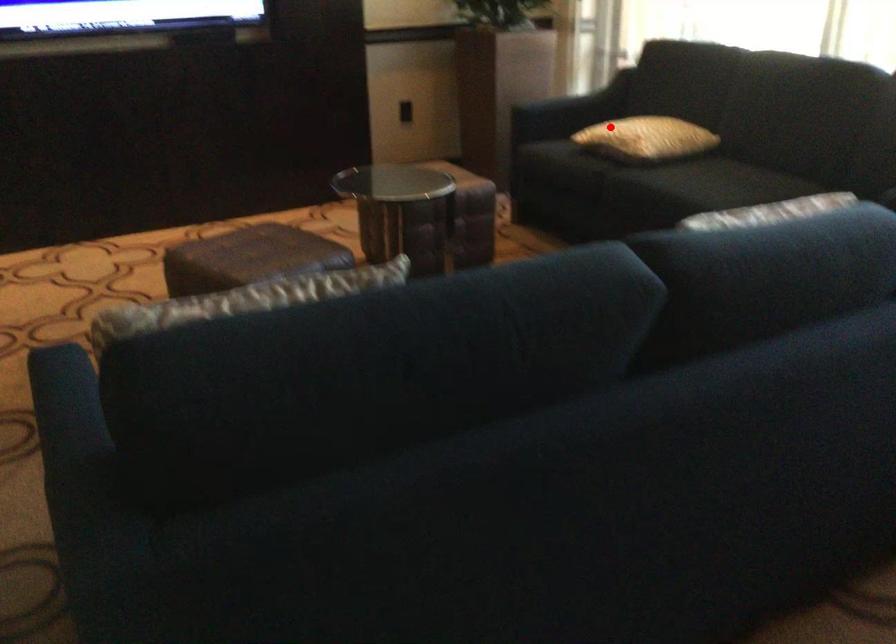
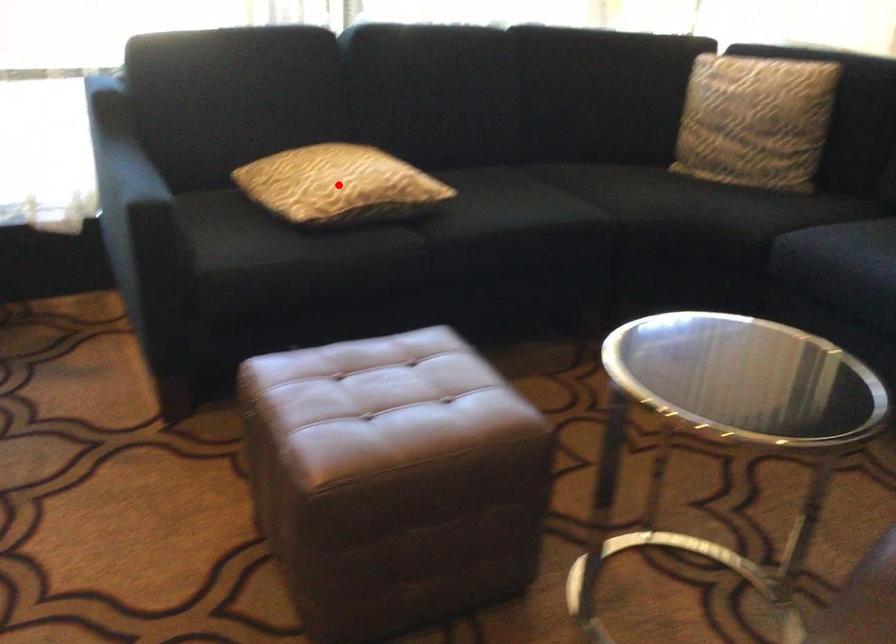
I am providing you with two images of the same scene from different viewpoints. A red point is marked on the first image and another point is marked on the second image. Is the marked point in image1 the same physical position as the marked point in image2?

Yes